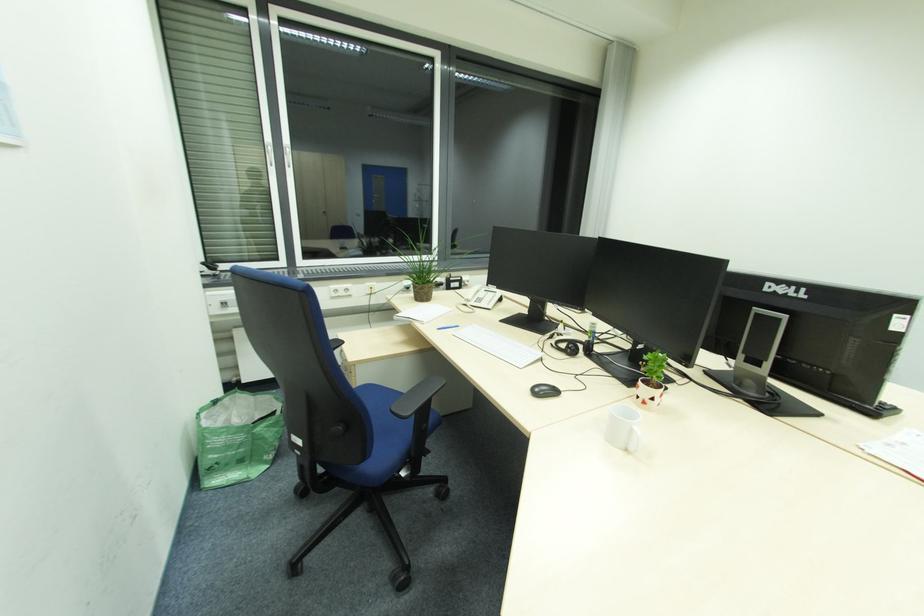
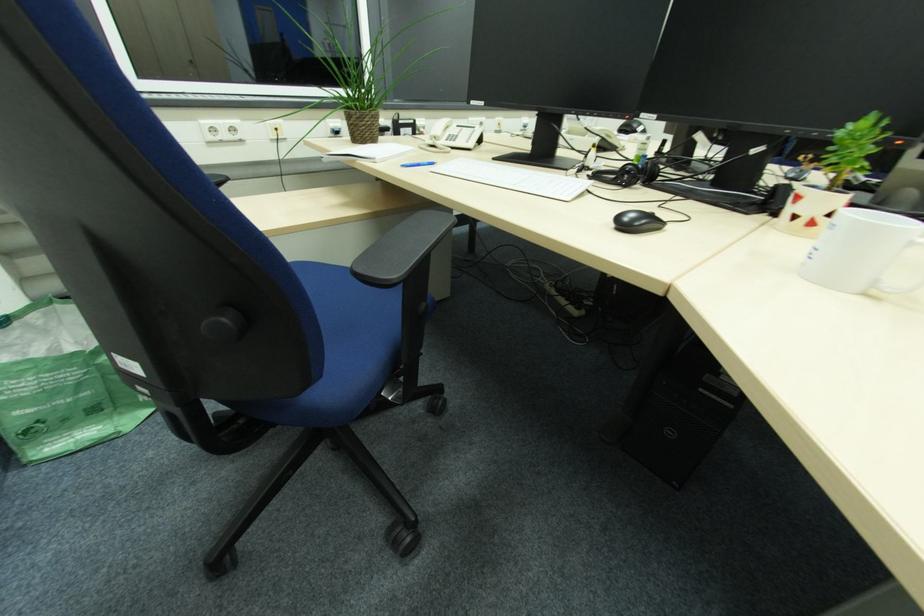
Question: Which direction would the cameraman need to move to produce the second image? Reply with the corresponding letter.

Choices:
 (A) Left
 (B) Right
 (C) Forward
 (D) Backward

Answer: (C)